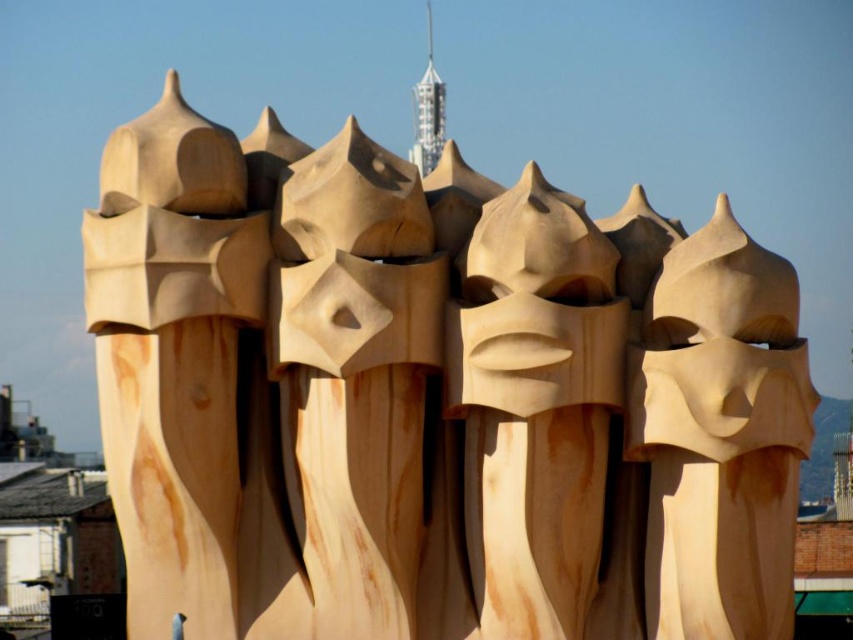
What are the coordinates of the natural wood sculpture at upper left?

The natural wood sculpture at upper left is located at point (173,356).

You are an art student standing in front of the Casa Mila chimneys. You see a natural wood mask at center and a natural wood sculpture at center. Which object is positioned closer to you?

The natural wood mask at center is closer to the viewer than the natural wood sculpture at center.

You are an art student analyzing the composition of the architectural elements in the image. You notice two natural wood pieces in the scene. Which one is wider, the natural wood sculpture at upper left or the natural wood mask at center?

The natural wood sculpture at upper left might be wider than natural wood mask at center according to the description.